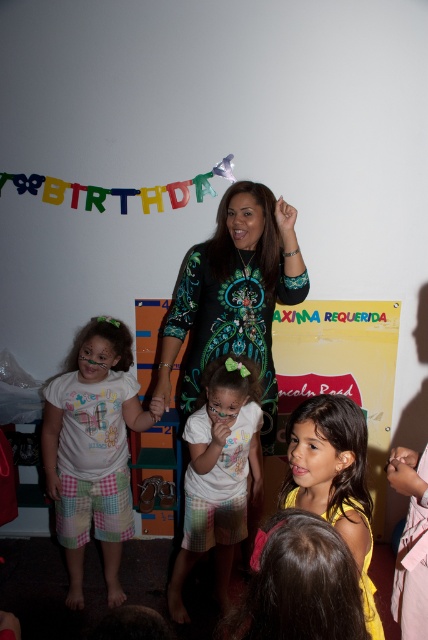
Find the location of `white cotton shirt at center`. white cotton shirt at center is located at coordinates (219, 472).

Who is shorter, white cotton shirt at center or yellow fabric dress at center?

yellow fabric dress at center

Is point (229, 513) farther from camera compared to point (324, 484)?

That is True.

You are a GUI agent. You are given a task and a screenshot of the screen. Output one action in this format:
    pyautogui.click(x=<x>, y=<y>)
    Task: Click on the white cotton shirt at center
    Image resolution: width=428 pixels, height=640 pixels.
    Given the screenshot: What is the action you would take?
    click(219, 472)

Consider the image. Who is more distant from viewer, (166, 344) or (160, 410)?

Positioned behind is point (166, 344).

Is point (288, 259) in front of point (59, 541)?

Yes, it is in front of point (59, 541).

Image resolution: width=428 pixels, height=640 pixels. I want to click on printed fabric dress at center, so click(234, 294).

Can you confirm if printed fabric dress at center is taller than yellow fabric dress at center?

Correct, printed fabric dress at center is much taller as yellow fabric dress at center.

Is printed fabric dress at center behind yellow fabric dress at center?

Yes, printed fabric dress at center is behind yellow fabric dress at center.

Which is in front, point (261, 227) or point (296, 506)?

Point (296, 506)

Find the location of a particular element. The height and width of the screenshot is (640, 428). printed fabric dress at center is located at coordinates (234, 294).